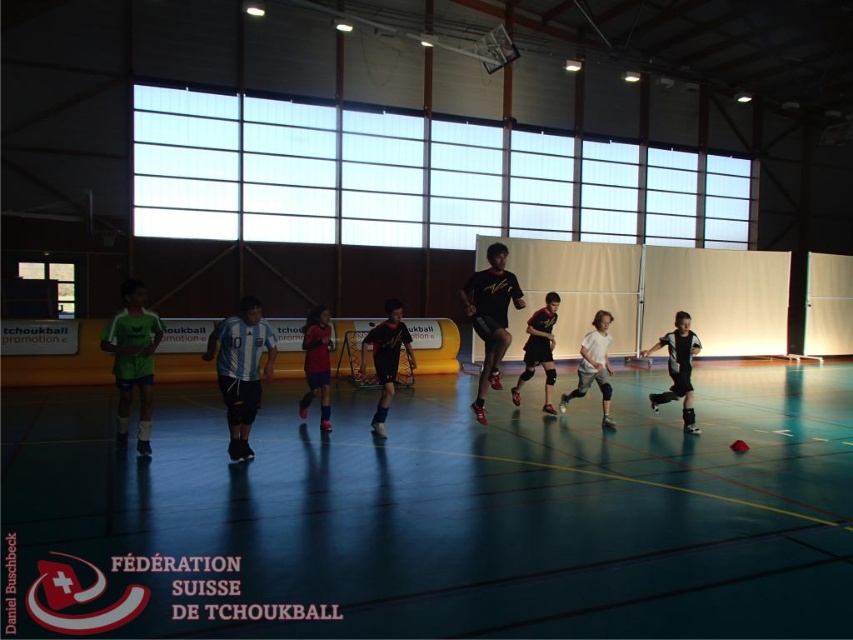
Between black matte uniform at center and black matte jersey at center, which one has less height?

Standing shorter between the two is black matte uniform at center.

Is point (686, 422) closer to viewer compared to point (521, 381)?

Yes, it is.

The image size is (853, 640). Identify the location of black matte uniform at center. (677, 368).

Who is taller, matte black shorts at center or black jersey at center?

matte black shorts at center is taller.

Is point (469, 300) more distant than point (412, 365)?

Yes, point (469, 300) is behind point (412, 365).

Where is `matte black shorts at center`? This screenshot has height=640, width=853. matte black shorts at center is located at coordinates (490, 317).

Looking at this image, between green rubber basketball court at center and black jersey at center, which one has more height?

Standing taller between the two is black jersey at center.

In the scene shown: Is green rubber basketball court at center above black jersey at center?

No.

Does point (785, 467) come behind point (392, 381)?

That is False.

Find the location of a particular element. green rubber basketball court at center is located at coordinates (457, 515).